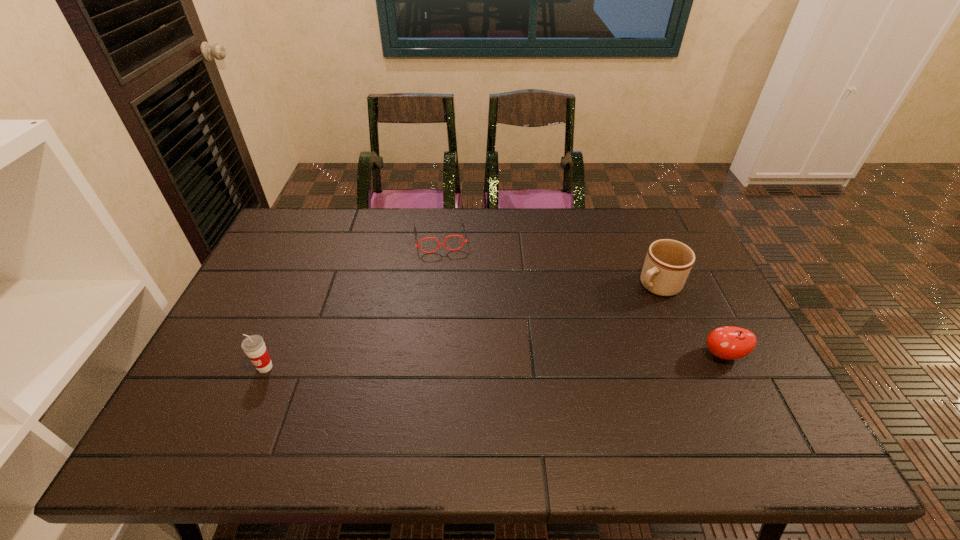
Where is `cup`? The height and width of the screenshot is (540, 960). cup is located at coordinates (254, 347).

Identify the location of apple. (729, 342).

This screenshot has width=960, height=540. Find the location of `the farthest object`. the farthest object is located at coordinates (444, 244).

Identify the location of the second object from left to right. The width and height of the screenshot is (960, 540). (444, 244).

The height and width of the screenshot is (540, 960). Identify the location of the third nearest object. (668, 263).

At what (x,y) coordinates should I click in order to perform the action: click on vacant region located 0.080m on the side of the cup with the logo. Please return your answer as a coordinate pair (x, y). Image resolution: width=960 pixels, height=540 pixels. Looking at the image, I should click on (250, 404).

You are a GUI agent. You are given a task and a screenshot of the screen. Output one action in this format:
    pyautogui.click(x=<x>, y=<y>)
    Task: Click on the free space located on the left of the apple
    The width and height of the screenshot is (960, 540).
    Given the screenshot: What is the action you would take?
    pyautogui.click(x=627, y=355)

The width and height of the screenshot is (960, 540). What are the coordinates of `free space located on the front-facing side of the shortest object` in the screenshot? It's located at (455, 335).

Where is `vacant space located 0.140m on the front-facing side of the shortest object`? vacant space located 0.140m on the front-facing side of the shortest object is located at coordinates (447, 284).

At what (x,y) coordinates should I click in order to perform the action: click on free spot located on the front-facing side of the shortest object. Please return your answer as a coordinate pair (x, y). Looking at the image, I should click on (452, 319).